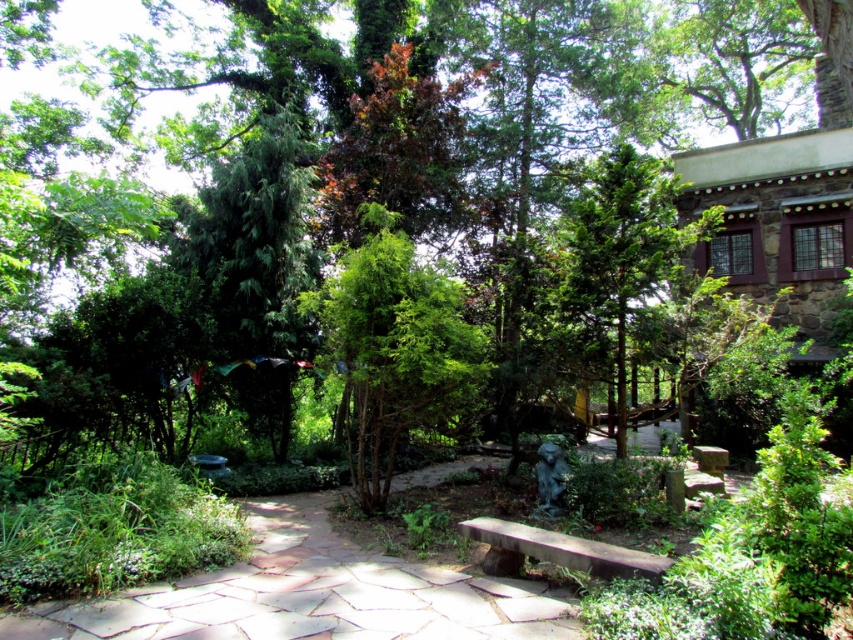
You are standing at the entrance of the garden and see the green textured tree at center. If you want to take a photo of the tree from exactly 6 meters away, should you move closer or farther away?

The green textured tree at center is currently 6.57 meters away from you. To take the photo from exactly 6 meters away, you should move closer to the tree by 0.57 meters.

You are a gardener who needs to water the green textured tree at upper left and the smooth stone bench at center. You have a hose that can reach 6 meters. Starting from the bench, can you water the tree without moving the hose nozzle?

The distance between the green textured tree at upper left and the smooth stone bench at center is 6.84 meters. Since the hose can only reach 6 meters, you will need to move the hose nozzle closer to the tree to water it.

You are standing at the entrance of the garden and see the green textured tree at center. If you walk directly towards the tree, will you encounter any obstacles along the path? Please explain your reasoning based on the garden layout described.

The garden layout includes a stone pathway that meanders through the garden, bordered by low plants and wildflowers. Since the green textured tree at center is positioned at point (393, 348), which is centrally located, the pathway likely leads directly toward it without major obstacles. The low plants and wildflowers along the path are not tall enough to block the way, so you can walk towards the tree without encountering significant obstacles.